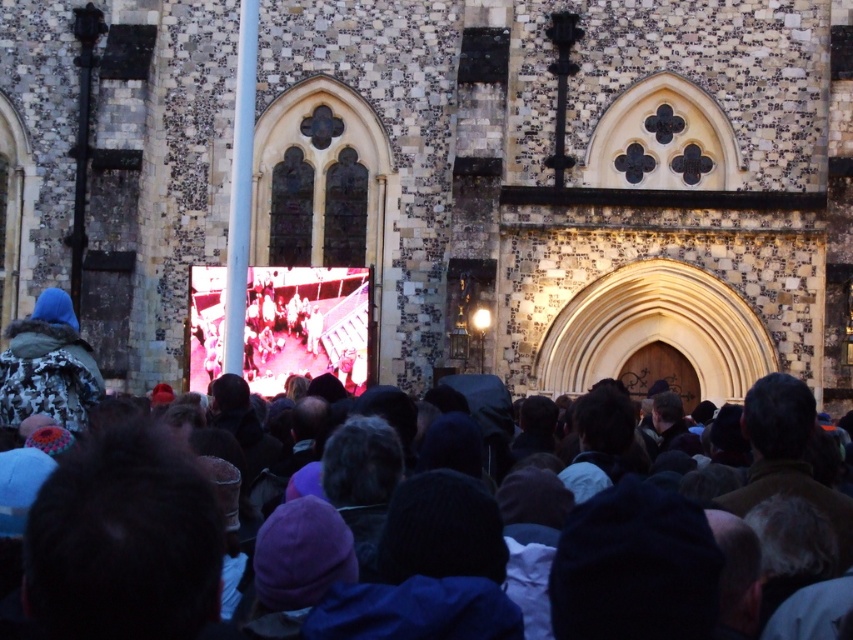
You are a photographer standing in front of the historic stone building. You notice two items in the crowd ahead of you. The first is dark gray knit hats at center, and the second is camouflage jacket at left. Which of these items is taller?

The camouflage jacket at left is taller than the dark gray knit hats at center.

Consider the image. You are standing in front of the historic stone building and want to take a photo of the stone textured church at center. If your camera has a maximum focus range of 60 meters, will you be able to capture the church clearly?

The stone textured church at center is 63.46 meters away from viewer, which exceeds the camera maximum focus range of 60 meters. Therefore, the camera cannot capture the church clearly.